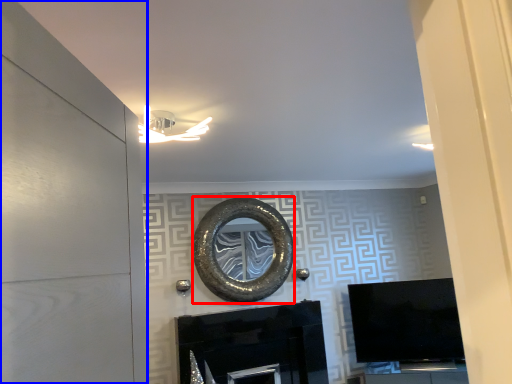
Question: Among these objects, which one is farthest to the camera, oval (highlighted by a red box) or door (highlighted by a blue box)?

Choices:
 (A) oval
 (B) door

Answer: (A)